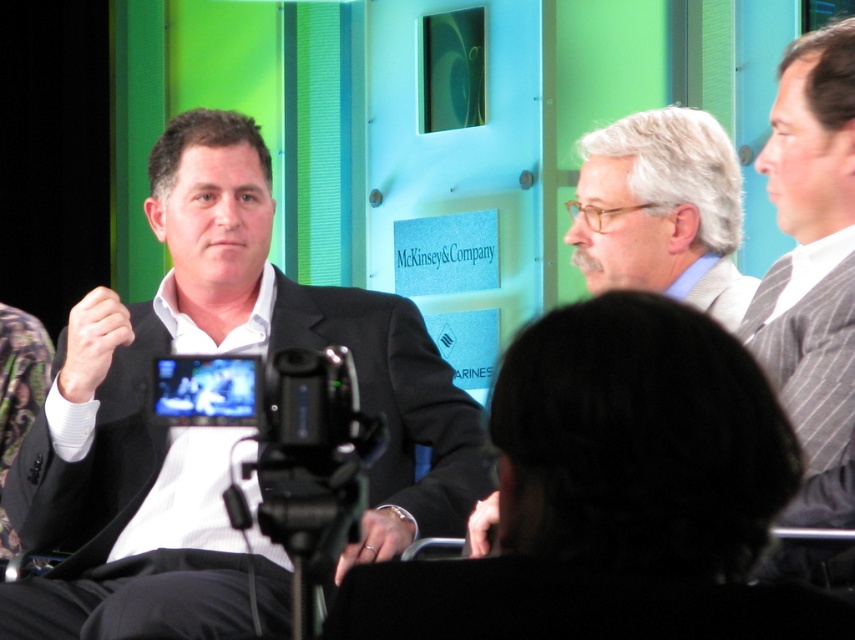
Question: Considering the relative positions of gray striped sweater at right and gray textured suit at center in the image provided, where is gray striped sweater at right located with respect to gray textured suit at center?

Choices:
 (A) left
 (B) right

Answer: (B)

Question: Can you confirm if black matte suit at center is positioned below gray textured suit at center?

Choices:
 (A) no
 (B) yes

Answer: (B)

Question: Which object is farther from the camera taking this photo?

Choices:
 (A) gray striped sweater at right
 (B) black matte suit at center

Answer: (B)

Question: From the image, what is the correct spatial relationship of black matte suit at center in relation to gray striped sweater at right?

Choices:
 (A) right
 (B) left

Answer: (B)

Question: Which of the following is the closest to the observer?

Choices:
 (A) (393, 316)
 (B) (668, 243)

Answer: (B)

Question: Considering the real-world distances, which object is farthest from the gray textured suit at center?

Choices:
 (A) black matte suit at center
 (B) gray striped sweater at right

Answer: (A)